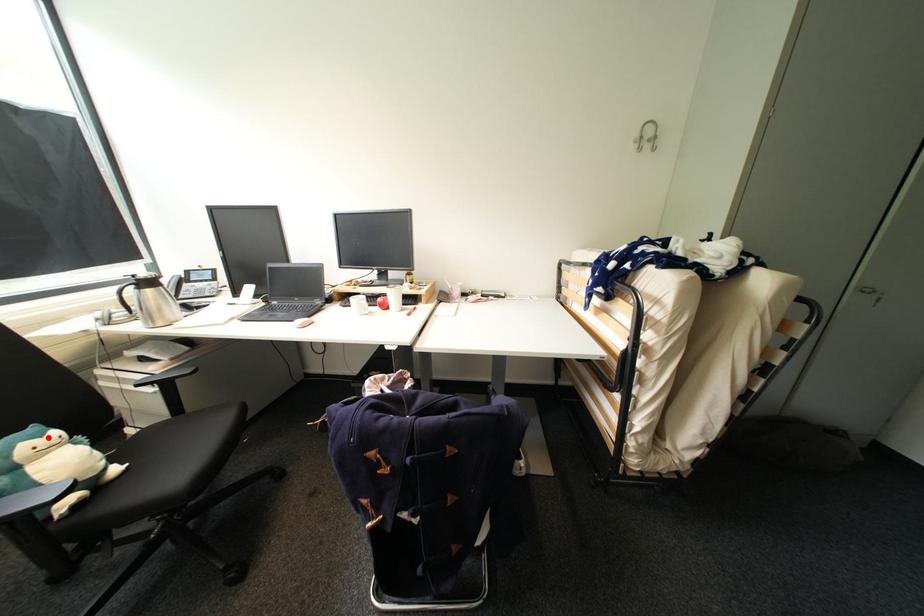
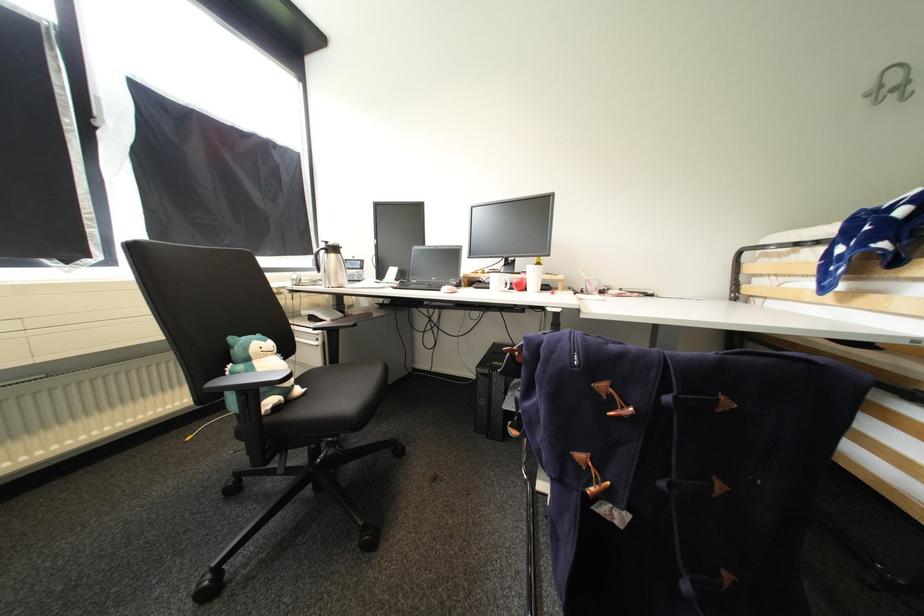
The point at the highlighted location is marked in the first image. Where is the corresponding point in the second image?

(272, 342)